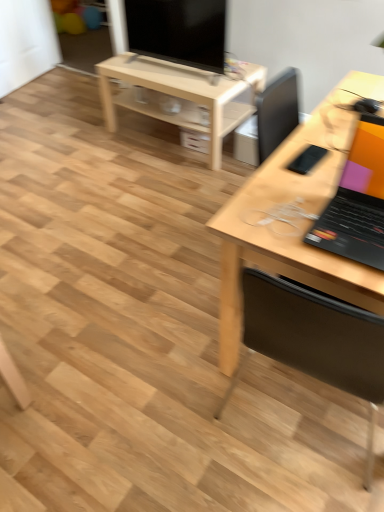
Question: From the image's perspective, is light wood/unfinished table at center located above or below wooden chair at right?

Choices:
 (A) below
 (B) above

Answer: (B)

Question: Does point (175, 89) appear closer or farther from the camera than point (380, 393)?

Choices:
 (A) closer
 (B) farther

Answer: (B)

Question: Based on their relative distances, which object is farther from the matte black tv at upper center?

Choices:
 (A) light wood/unfinished table at center
 (B) light wood desk at right
 (C) black matte laptop at right
 (D) wooden chair at right

Answer: (D)

Question: Which of these objects is positioned closest to the wooden chair at right?

Choices:
 (A) black matte laptop at right
 (B) matte black tv at upper center
 (C) light wood desk at right
 (D) light wood/unfinished table at center

Answer: (A)